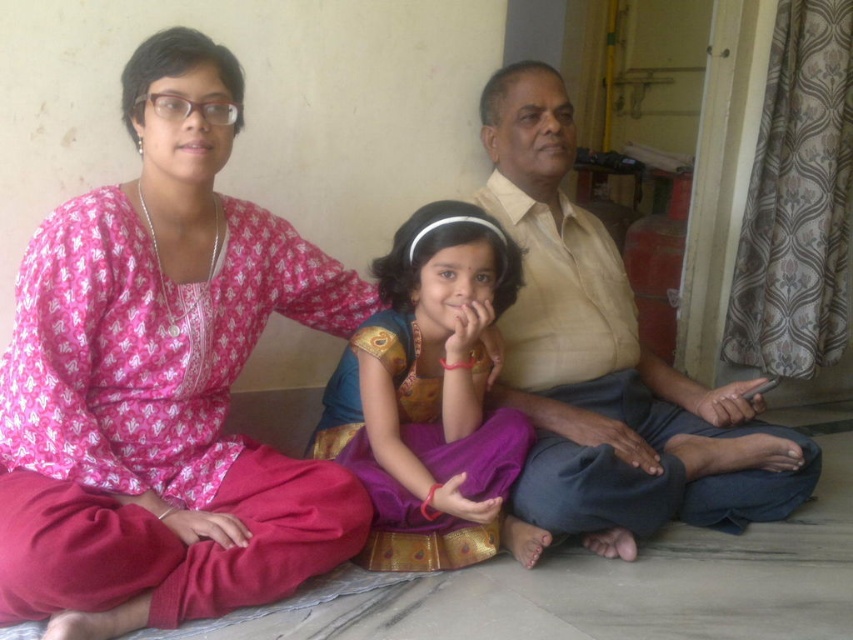
Question: From the image, what is the correct spatial relationship of pink printed dress at left in relation to purple satin saree at center?

Choices:
 (A) left
 (B) right

Answer: (A)

Question: Can you confirm if pink printed dress at left is smaller than beige cotton shirt at center?

Choices:
 (A) no
 (B) yes

Answer: (B)

Question: Which point is closer to the camera?

Choices:
 (A) (396, 536)
 (B) (160, 444)

Answer: (B)

Question: Is pink printed dress at left bigger than beige cotton shirt at center?

Choices:
 (A) no
 (B) yes

Answer: (A)

Question: Which point is farther from the camera taking this photo?

Choices:
 (A) (494, 253)
 (B) (189, 456)

Answer: (A)

Question: Which object appears closest to the camera in this image?

Choices:
 (A) beige cotton shirt at center
 (B) pink printed dress at left

Answer: (B)